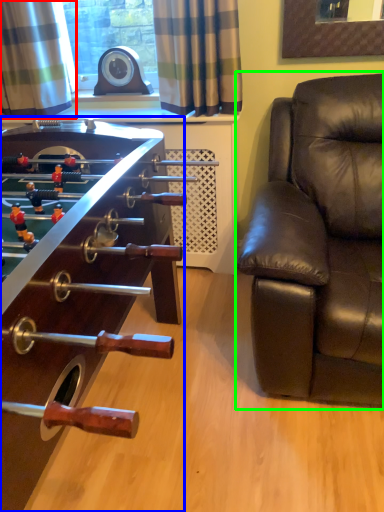
Question: Which is nearer to the curtain (highlighted by a red box)? table (highlighted by a blue box) or studio couch (highlighted by a green box).

Choices:
 (A) table
 (B) studio couch

Answer: (A)